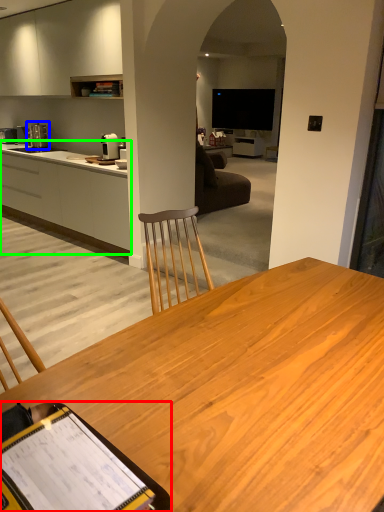
Question: Which object is the closest to the clipboard (highlighted by a red box)? Choose among these: coffee machine (highlighted by a blue box) or cabinetry (highlighted by a green box).

Choices:
 (A) coffee machine
 (B) cabinetry

Answer: (B)